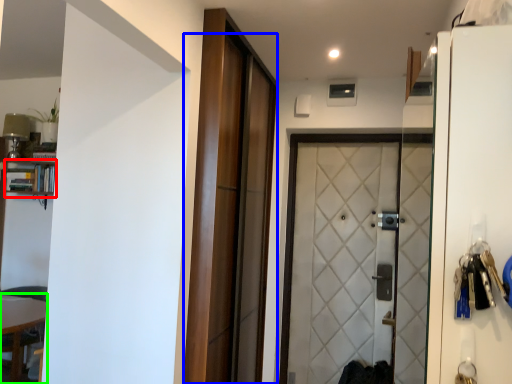
Question: Estimate the real-world distances between objects in this image. Which object is farther from bookshelf (highlighted by a red box), door (highlighted by a blue box) or table (highlighted by a green box)?

Choices:
 (A) door
 (B) table

Answer: (A)